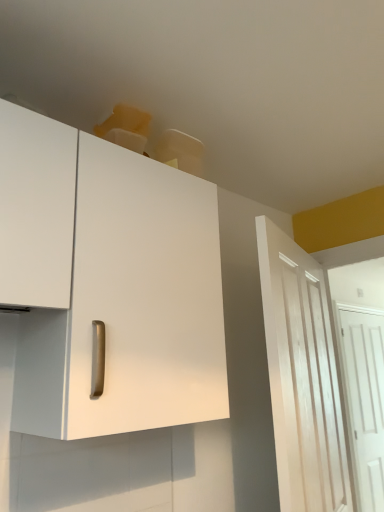
Question: Considering the positions of point (279, 308) and point (365, 433), is point (279, 308) closer or farther from the camera than point (365, 433)?

Choices:
 (A) closer
 (B) farther

Answer: (A)

Question: From a real-world perspective, is white wood door at right, which ranks as the 1th door in left-to-right order, above or below white wooden door at right, the first door from the right?

Choices:
 (A) above
 (B) below

Answer: (A)

Question: Based on their relative distances, which object is farther from the white wood door at right, which is counted as the 2th door, starting from the back?

Choices:
 (A) white wooden door at right, which is the 2th door from front to back
 (B) white matte cabinet at upper left

Answer: (A)

Question: Estimate the real-world distances between objects in this image. Which object is farther from the white wooden door at right, the second door viewed from the left?

Choices:
 (A) white matte cabinet at upper left
 (B) white wood door at right, which is counted as the 2th door, starting from the back

Answer: (A)